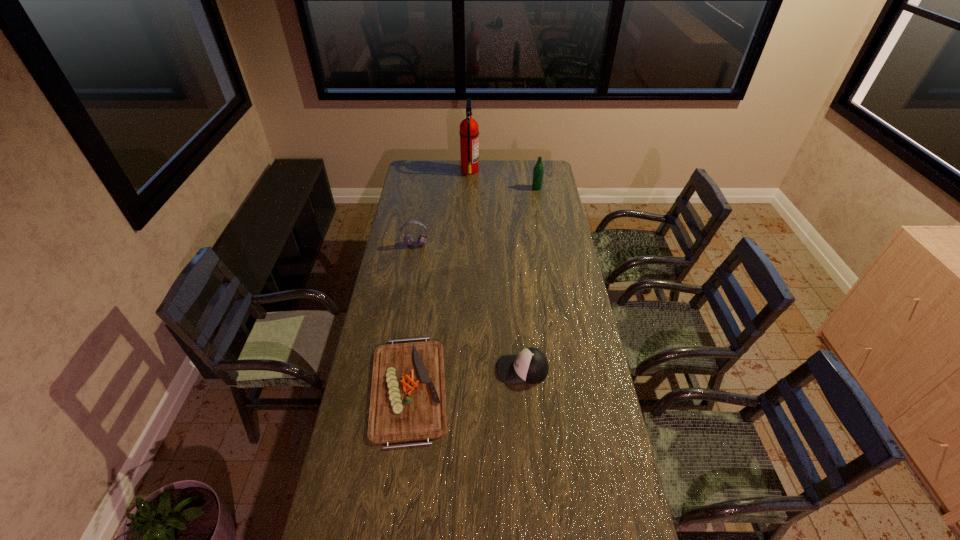
Find the location of a particular element. The width and height of the screenshot is (960, 540). fire extinguisher is located at coordinates (469, 148).

Locate an element on the screen. This screenshot has width=960, height=540. the farthest object is located at coordinates [469, 148].

I want to click on the fourth nearest object, so click(x=538, y=171).

Where is `the rightmost object`? This screenshot has height=540, width=960. the rightmost object is located at coordinates (538, 171).

Find the location of a particular element. the third nearest object is located at coordinates (408, 239).

Identify the location of headset. (408, 239).

This screenshot has width=960, height=540. I want to click on the second object from right to left, so click(531, 366).

Where is `the second shortest object`? The image size is (960, 540). the second shortest object is located at coordinates (531, 366).

The height and width of the screenshot is (540, 960). Identify the location of chopping board. (408, 402).

I want to click on vacant region located on the side of the farthest object near the handle, so click(x=510, y=170).